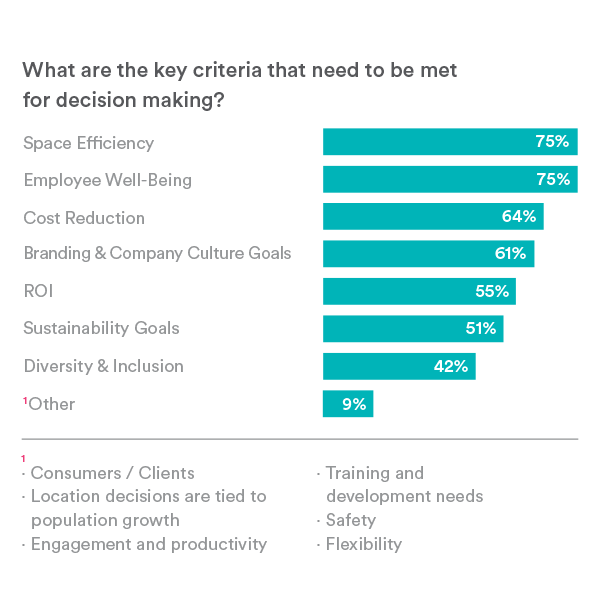
Identify the location of the second loongest bar. (441, 212).